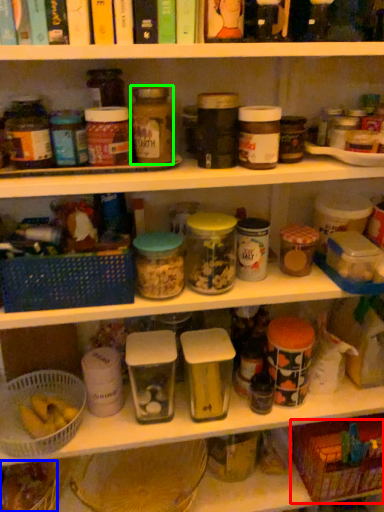
Question: Which object is the farthest from basket (highlighted by a red box)? Choose among these: food (highlighted by a blue box) or bottle (highlighted by a green box).

Choices:
 (A) food
 (B) bottle

Answer: (B)